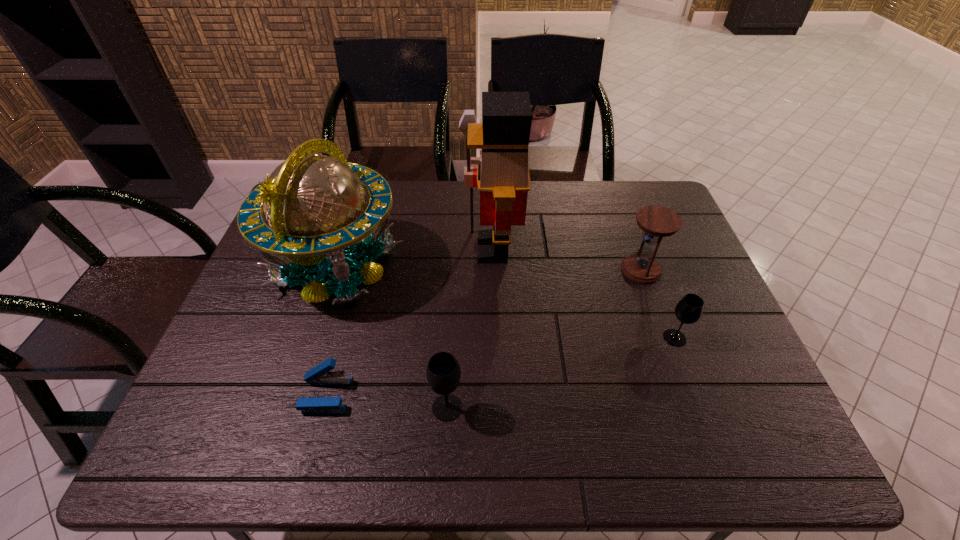
Locate an element on the screen. The image size is (960, 540). wineglass that is at the right edge is located at coordinates (689, 309).

The image size is (960, 540). Find the location of `object present at the far left corner`. object present at the far left corner is located at coordinates (316, 205).

Find the location of a particular element. The image size is (960, 540). blank space at the far edge of the desktop is located at coordinates (578, 217).

Find the location of a particular element. vacant space at the near edge is located at coordinates (445, 452).

In order to click on free area in between the stapler and the farther wineglass in this screenshot , I will do `click(500, 366)`.

Where is `blank region between the tallest object and the hourglass`? The height and width of the screenshot is (540, 960). blank region between the tallest object and the hourglass is located at coordinates (566, 260).

Find the location of `vacant point located between the tallest object and the stapler`. vacant point located between the tallest object and the stapler is located at coordinates (409, 322).

At what (x,y) coordinates should I click in order to perform the action: click on empty space between the right wineglass and the hourglass. Please return your answer as a coordinate pair (x, y). Looking at the image, I should click on (658, 303).

The width and height of the screenshot is (960, 540). In order to click on free space that is in between the hourglass and the nearer wineglass in this screenshot , I will do `click(544, 339)`.

Identify the location of free space between the stapler and the right wineglass. Image resolution: width=960 pixels, height=540 pixels. (500, 366).